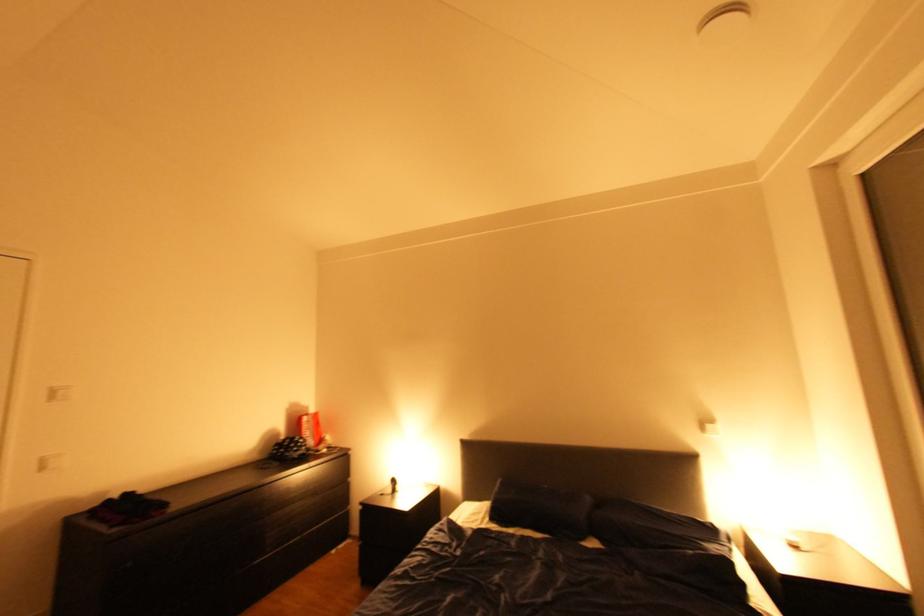
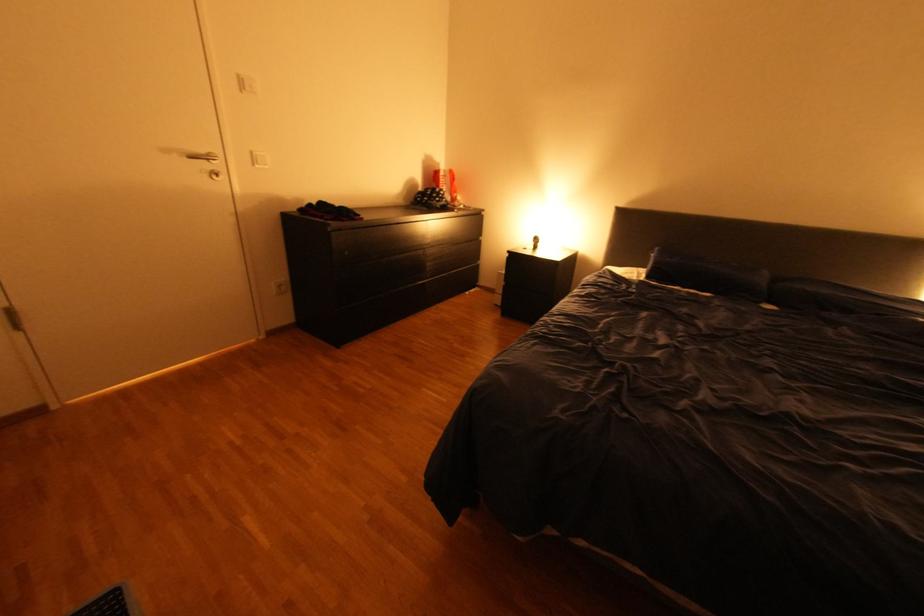
Find the pixel in the second image that matches pixel 492 517 in the first image.

(648, 277)